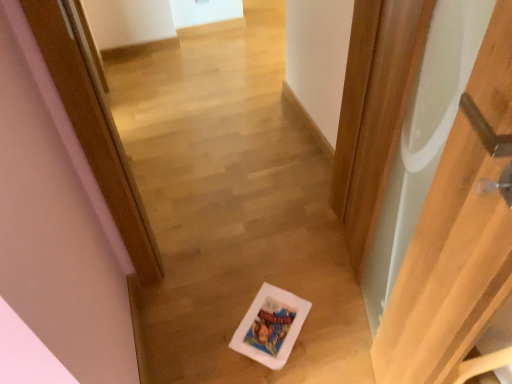
The width and height of the screenshot is (512, 384). Describe the element at coordinates (458, 236) in the screenshot. I see `white glossy door at right` at that location.

Measure the distance between point (505, 214) and camera.

23.19 inches.

Locate an element on the screen. white glossy door at right is located at coordinates (458, 236).

You are a GUI agent. You are given a task and a screenshot of the screen. Output one action in this format:
    pyautogui.click(x=<x>, y=<y>)
    Task: Click on the white glossy door at right
    The height and width of the screenshot is (384, 512).
    Given the screenshot: What is the action you would take?
    pyautogui.click(x=458, y=236)